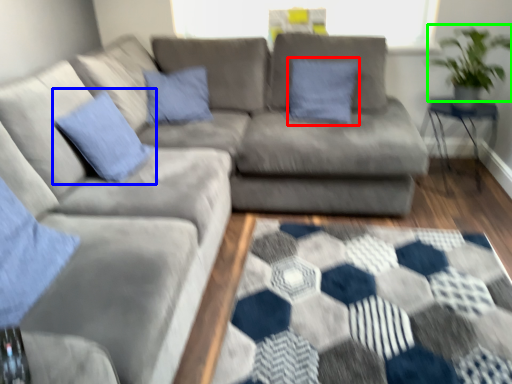
Question: Based on their relative distances, which object is nearer to pillow (highlighted by a red box)? Choose from pillow (highlighted by a blue box) and plant (highlighted by a green box).

Choices:
 (A) pillow
 (B) plant

Answer: (B)